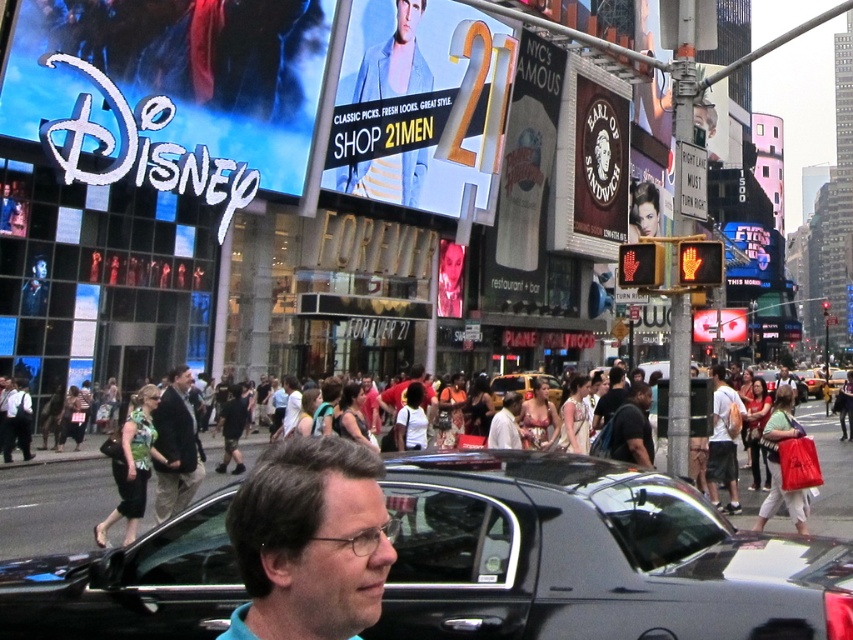
Between white glossy sign at upper left and matte red bag at lower right, which one appears on the left side from the viewer's perspective?

white glossy sign at upper left is more to the left.

Is point (264, 144) positioned after point (804, 435)?

Yes, it is behind point (804, 435).

Between point (254, 24) and point (779, 493), which one is positioned in front?

Point (779, 493) is in front.

The width and height of the screenshot is (853, 640). I want to click on white glossy sign at upper left, so click(x=183, y=70).

Can you confirm if green floral dress at center is bigger than metallic silver sign at center?

Actually, green floral dress at center might be smaller than metallic silver sign at center.

Between point (140, 449) and point (711, 324), which one is positioned behind?

The point (711, 324) is behind.

The width and height of the screenshot is (853, 640). In order to click on green floral dress at center in this screenshot , I will do `click(132, 465)`.

Is matte yellow sign at center behind matte black backpack at center?

Yes.

Can you confirm if matte yellow sign at center is positioned to the right of matte black backpack at center?

Incorrect, matte yellow sign at center is not on the right side of matte black backpack at center.

Is point (456, 120) farther from viewer compared to point (775, 387)?

Yes, it is behind point (775, 387).

You are a GUI agent. You are given a task and a screenshot of the screen. Output one action in this format:
    pyautogui.click(x=<x>, y=<y>)
    Task: Click on the matte yellow sign at center
    The height and width of the screenshot is (640, 853).
    Given the screenshot: What is the action you would take?
    pyautogui.click(x=418, y=104)